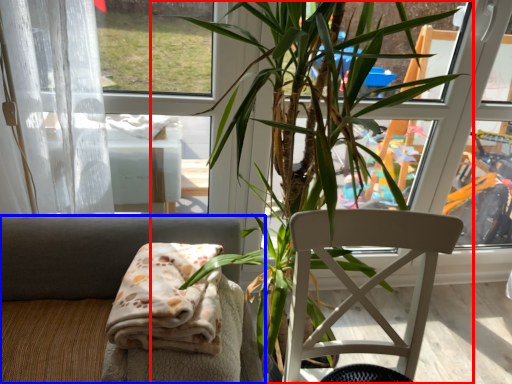
Question: Among these objects, which one is nearest to the camera, houseplant (highlighted by a red box) or chair (highlighted by a blue box)?

Choices:
 (A) houseplant
 (B) chair

Answer: (A)